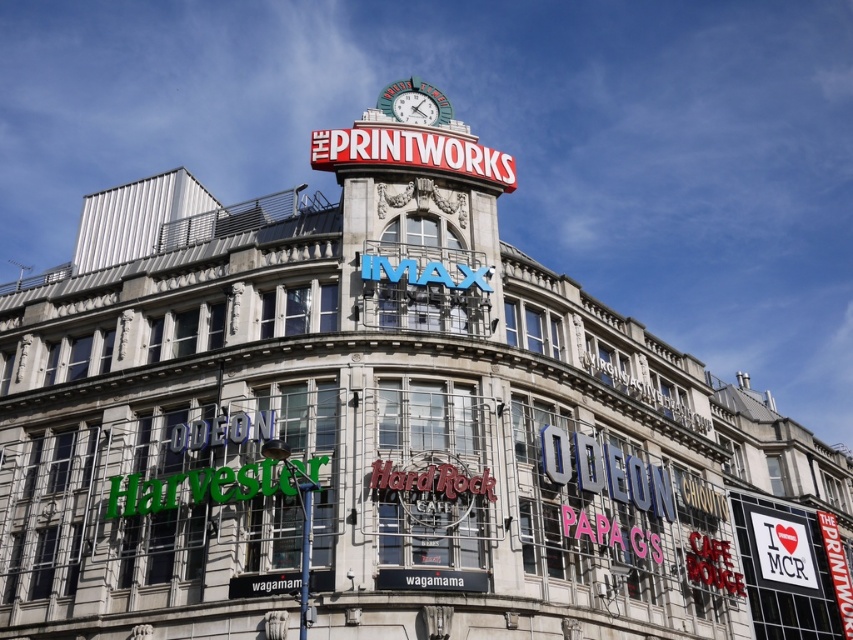
Question: Which of these objects is positioned closest to the metallic clock face at center top?

Choices:
 (A) white plastic sign at upper center
 (B) red metallic sign at center top

Answer: (B)

Question: Is red metallic sign at center top smaller than metallic clock face at center top?

Choices:
 (A) no
 (B) yes

Answer: (A)

Question: Considering the relative positions of white plastic sign at upper center and metallic clock face at center top in the image provided, where is white plastic sign at upper center located with respect to metallic clock face at center top?

Choices:
 (A) left
 (B) right

Answer: (B)

Question: Which is farther from the white plastic sign at upper center?

Choices:
 (A) metallic clock face at center top
 (B) red metallic sign at center top

Answer: (A)

Question: Is white plastic sign at upper center positioned behind metallic clock face at center top?

Choices:
 (A) no
 (B) yes

Answer: (B)

Question: Which point appears farthest from the camera in this image?

Choices:
 (A) (766, 560)
 (B) (437, 116)

Answer: (A)